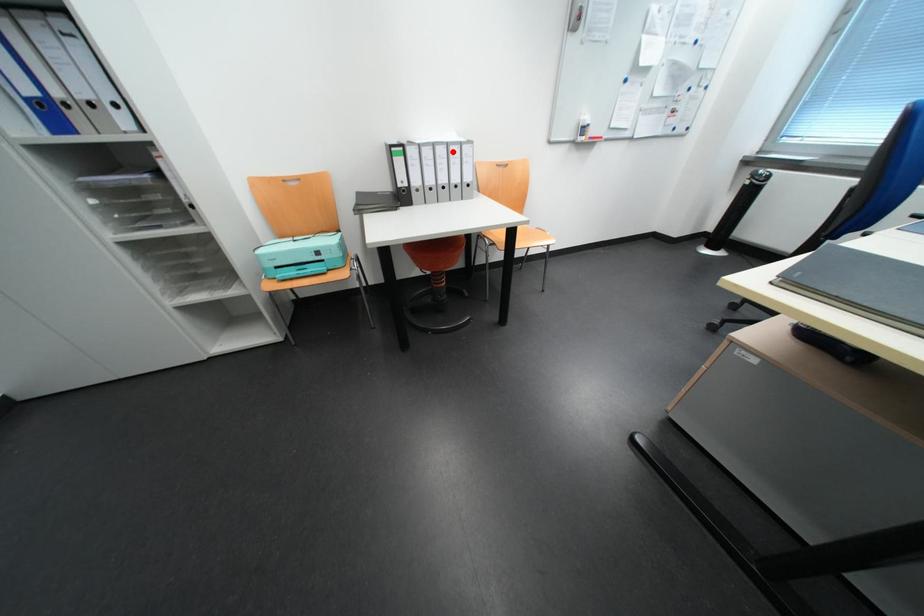
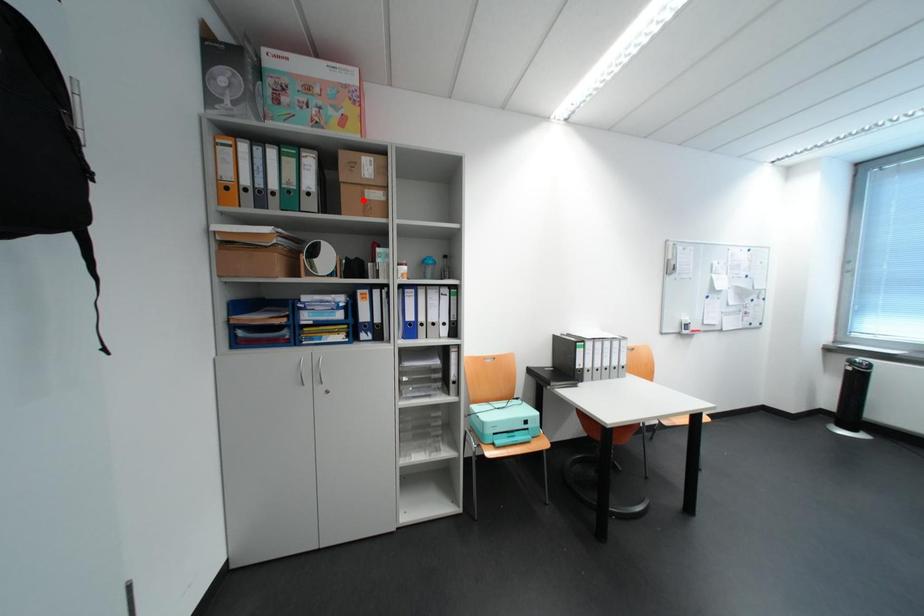
I am providing you with two images of the same scene from different viewpoints. A red point is marked on the first image and another point is marked on the second image. Does the point marked in image1 correspond to the same location as the one in image2?

No